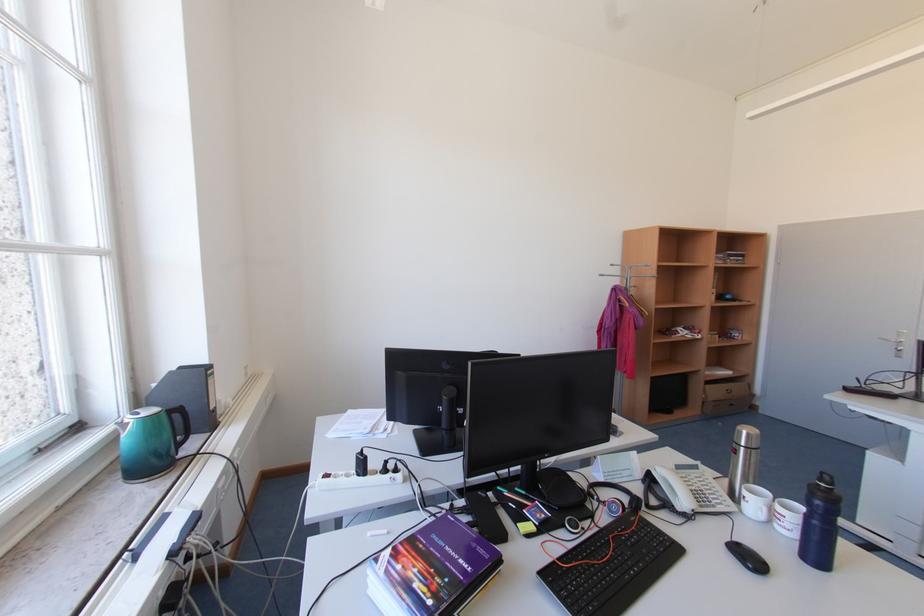
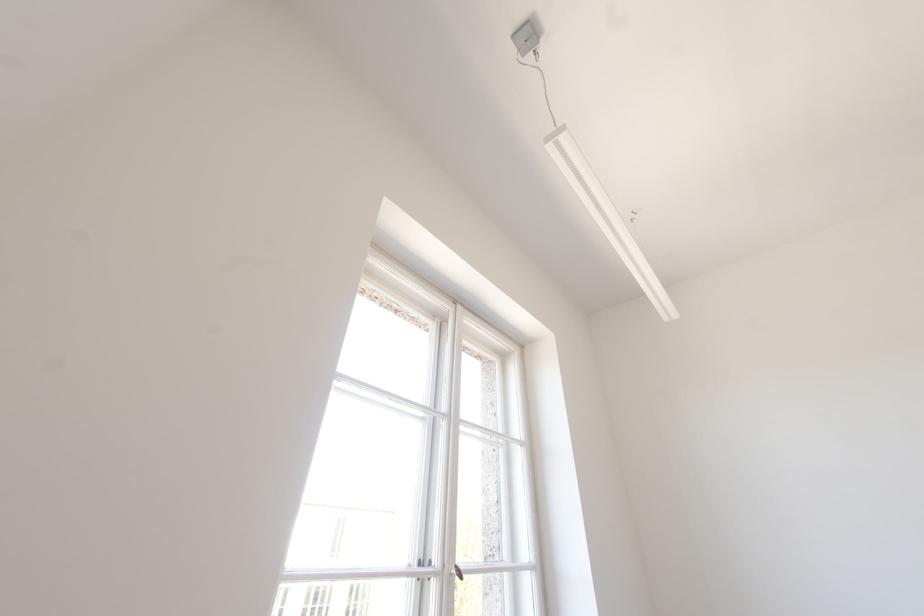
The first image is from the beginning of the video and the second image is from the end. How did the camera likely rotate when shooting the video?

The rotation direction of the camera is left-up.